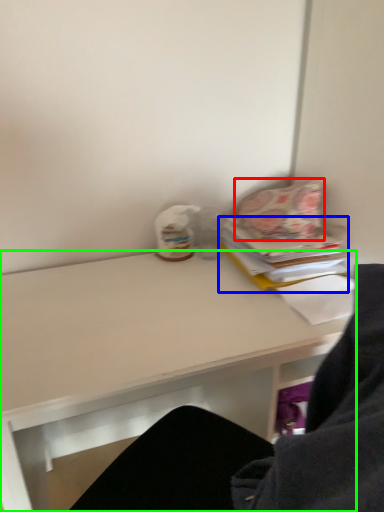
Question: Based on their relative distances, which object is farther from pillow (highlighted by a red box)? Choose from paperback book (highlighted by a blue box) and desk (highlighted by a green box).

Choices:
 (A) paperback book
 (B) desk

Answer: (B)